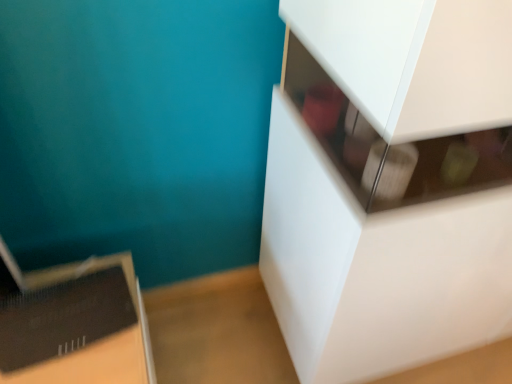
Question: Does white glossy cabinet at upper right have a smaller size compared to black cardboard box at lower left?

Choices:
 (A) yes
 (B) no

Answer: (B)

Question: Does white glossy cabinet at upper right have a greater height compared to black cardboard box at lower left?

Choices:
 (A) yes
 (B) no

Answer: (A)

Question: Is white glossy cabinet at upper right closer to the viewer compared to black cardboard box at lower left?

Choices:
 (A) yes
 (B) no

Answer: (A)

Question: Is white glossy cabinet at upper right at the right side of black cardboard box at lower left?

Choices:
 (A) no
 (B) yes

Answer: (B)

Question: Can black cardboard box at lower left be found inside white glossy cabinet at upper right?

Choices:
 (A) yes
 (B) no

Answer: (B)

Question: From a real-world perspective, is white glossy cabinet at upper right physically above black cardboard box at lower left?

Choices:
 (A) yes
 (B) no

Answer: (A)

Question: Is white glossy cabinet at upper right completely or partially inside black cardboard box at lower left?

Choices:
 (A) yes
 (B) no

Answer: (B)

Question: Considering the relative positions of black cardboard box at lower left and white glossy cabinet at upper right in the image provided, is black cardboard box at lower left behind white glossy cabinet at upper right?

Choices:
 (A) no
 (B) yes

Answer: (B)

Question: Is black cardboard box at lower left thinner than white glossy cabinet at upper right?

Choices:
 (A) no
 (B) yes

Answer: (B)

Question: Is black cardboard box at lower left oriented towards white glossy cabinet at upper right?

Choices:
 (A) no
 (B) yes

Answer: (A)

Question: Is black cardboard box at lower left at the left side of white glossy cabinet at upper right?

Choices:
 (A) yes
 (B) no

Answer: (A)

Question: Is black cardboard box at lower left in contact with white glossy cabinet at upper right?

Choices:
 (A) yes
 (B) no

Answer: (B)

Question: Is point (295, 137) positioned closer to the camera than point (119, 334)?

Choices:
 (A) closer
 (B) farther

Answer: (A)